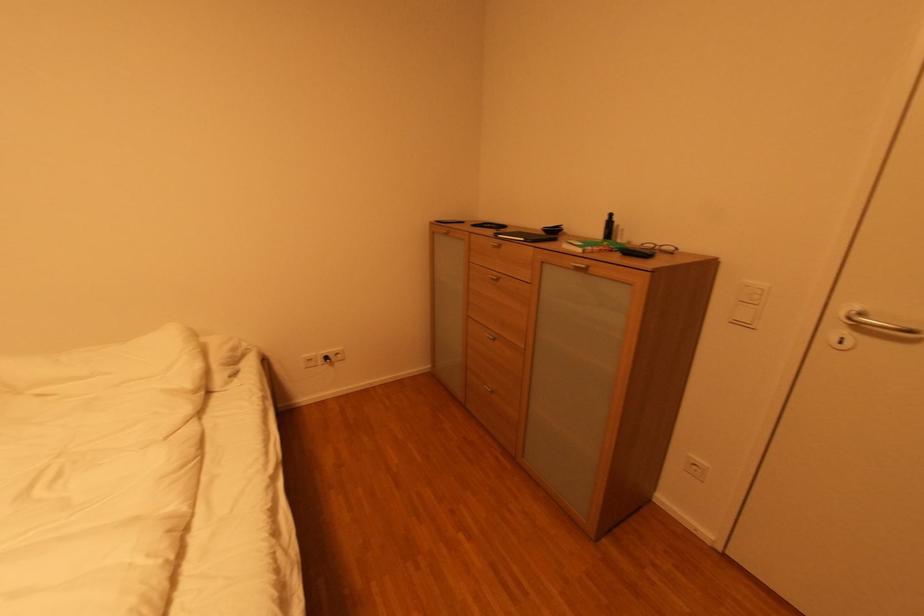
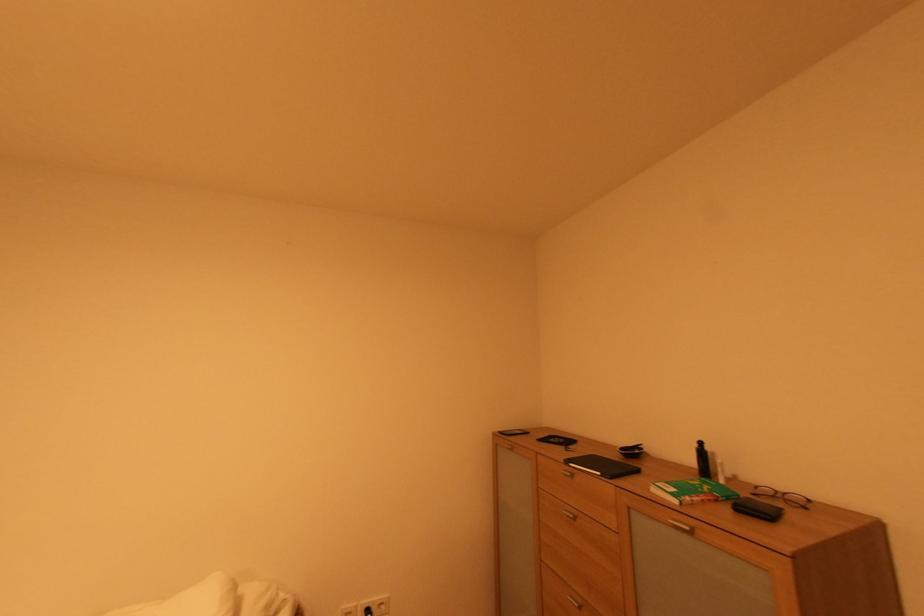
The point at (590, 267) is marked in the first image. Where is the corresponding point in the second image?

(694, 530)